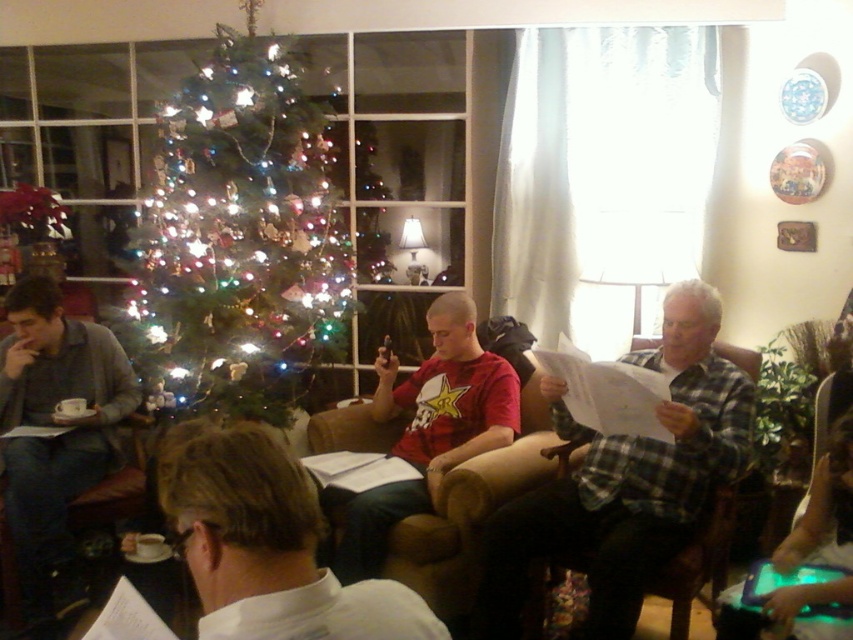
Question: Can you confirm if iridescent glass christmas tree at center is positioned to the left of plaid flannel shirt at center?

Choices:
 (A) yes
 (B) no

Answer: (A)

Question: Is iridescent glass christmas tree at center above white paper at center?

Choices:
 (A) no
 (B) yes

Answer: (B)

Question: Does gray sweater at left lie behind red matte shirt at center?

Choices:
 (A) no
 (B) yes

Answer: (B)

Question: Which of the following is the closest to the observer?

Choices:
 (A) (471, 356)
 (B) (86, 368)
 (C) (169, 483)
 (D) (293, 132)

Answer: (C)

Question: Which point is closer to the camera?

Choices:
 (A) red matte shirt at center
 (B) gray sweater at left
 (C) white paper at center

Answer: (C)

Question: Which of these objects is positioned farthest from the plaid flannel shirt at center?

Choices:
 (A) red matte shirt at center
 (B) gray sweater at left
 (C) iridescent glass christmas tree at center

Answer: (B)